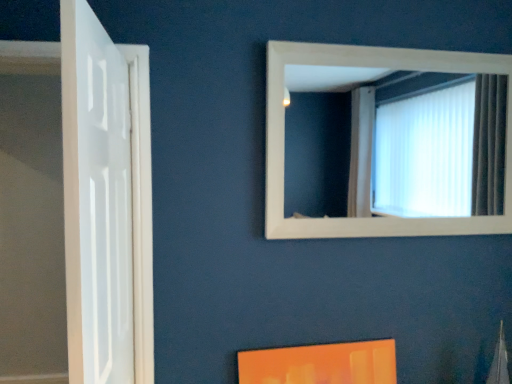
Question: Is white wooden frame at upper center smaller than white glossy door at left?

Choices:
 (A) no
 (B) yes

Answer: (B)

Question: Does white wooden frame at upper center have a lesser height compared to white glossy door at left?

Choices:
 (A) no
 (B) yes

Answer: (B)

Question: Is white wooden frame at upper center positioned behind white glossy door at left?

Choices:
 (A) no
 (B) yes

Answer: (B)

Question: Considering the relative sizes of white wooden frame at upper center and white glossy door at left in the image provided, is white wooden frame at upper center wider than white glossy door at left?

Choices:
 (A) no
 (B) yes

Answer: (A)

Question: Does white wooden frame at upper center have a lesser width compared to white glossy door at left?

Choices:
 (A) yes
 (B) no

Answer: (A)

Question: Does white wooden frame at upper center contain white glossy door at left?

Choices:
 (A) yes
 (B) no

Answer: (B)

Question: From the image's perspective, would you say white glossy door at left is shown under white wooden frame at upper center?

Choices:
 (A) yes
 (B) no

Answer: (A)

Question: Is white glossy door at left surrounding white wooden frame at upper center?

Choices:
 (A) yes
 (B) no

Answer: (B)

Question: Is white glossy door at left wider than white wooden frame at upper center?

Choices:
 (A) no
 (B) yes

Answer: (B)

Question: Considering the relative sizes of white glossy door at left and white wooden frame at upper center in the image provided, is white glossy door at left taller than white wooden frame at upper center?

Choices:
 (A) yes
 (B) no

Answer: (A)

Question: From a real-world perspective, is white glossy door at left over white wooden frame at upper center?

Choices:
 (A) no
 (B) yes

Answer: (A)

Question: Can you confirm if white glossy door at left is shorter than white wooden frame at upper center?

Choices:
 (A) no
 (B) yes

Answer: (A)

Question: Visually, is white glossy door at left positioned to the left or to the right of white wooden frame at upper center?

Choices:
 (A) right
 (B) left

Answer: (B)